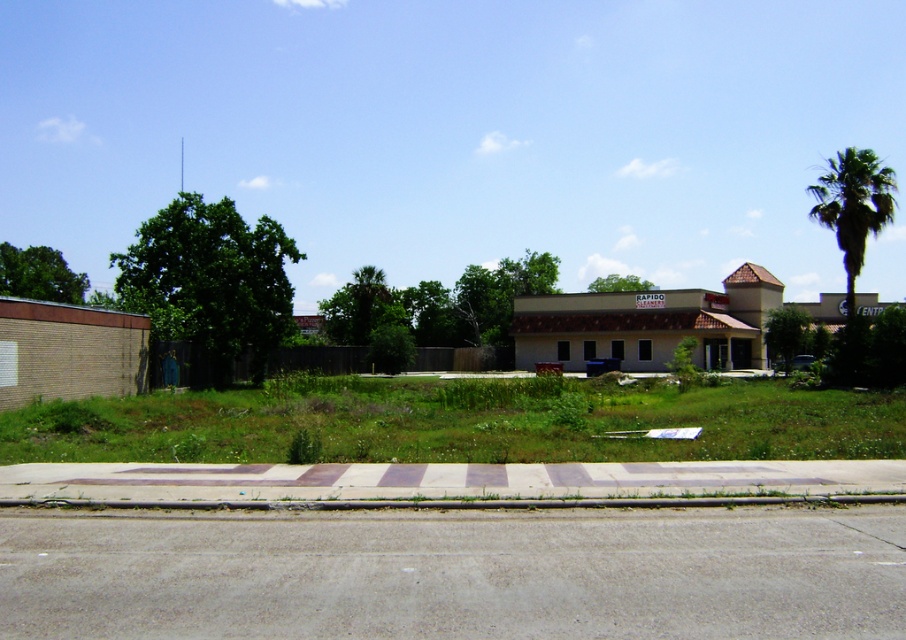
Question: Observing the image, what is the correct spatial positioning of green leafy tree at left in reference to green leafy palm tree at right?

Choices:
 (A) above
 (B) below

Answer: (B)

Question: Which of the following is the farthest from the observer?

Choices:
 (A) green leafy tree at center
 (B) green leafy palm tree at right
 (C) green leafy tree at upper center
 (D) green leafy tree at left

Answer: (C)

Question: Among these points, which one is nearest to the camera?

Choices:
 (A) (124, 264)
 (B) (812, 189)
 (C) (2, 280)
 (D) (770, 348)

Answer: (A)

Question: Is green leafy tree at left wider than green leafy tree at upper center?

Choices:
 (A) no
 (B) yes

Answer: (B)

Question: Is green leafy tree at upper left wider than green leafy tree at center?

Choices:
 (A) yes
 (B) no

Answer: (A)

Question: Which is nearer to the green leafy tree at upper center?

Choices:
 (A) green leafy palm tree at right
 (B) green leafy tree at center

Answer: (A)